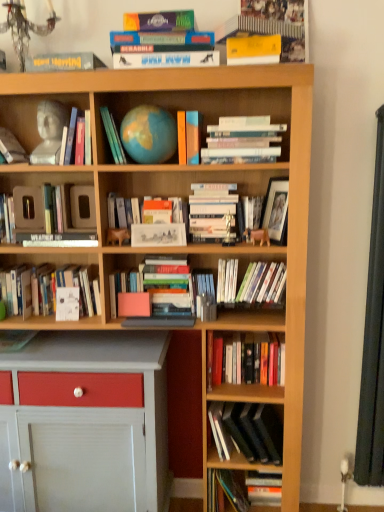
Question: Is hardcover book at center, which is the 10th book from top to bottom, outside of hardcover book at center, which is the 12th book in bottom-to-top order?

Choices:
 (A) yes
 (B) no

Answer: (A)

Question: Is hardcover book at center, which is the 10th book from top to bottom, shorter than hardcover book at center, acting as the 5th book starting from the top?

Choices:
 (A) no
 (B) yes

Answer: (B)

Question: From a real-world perspective, is hardcover book at center, the 7th book in the bottom-to-top sequence, on top of hardcover book at center, acting as the 5th book starting from the top?

Choices:
 (A) yes
 (B) no

Answer: (B)

Question: Could you tell me if hardcover book at center, the 7th book in the bottom-to-top sequence, is facing hardcover book at center, which is the 12th book in bottom-to-top order?

Choices:
 (A) yes
 (B) no

Answer: (B)

Question: Does hardcover book at center, the 7th book in the bottom-to-top sequence, lie in front of hardcover book at center, acting as the 5th book starting from the top?

Choices:
 (A) no
 (B) yes

Answer: (A)

Question: In the image, is hardcover books at center, the second book in the bottom-to-top sequence, positioned in front of or behind white paper at center, the 8th book in the bottom-to-top sequence?

Choices:
 (A) front
 (B) behind

Answer: (B)

Question: Looking at their shapes, would you say hardcover books at center, the 15th book viewed from the top, is wider or thinner than white paper at center, the 8th book in the bottom-to-top sequence?

Choices:
 (A) wide
 (B) thin

Answer: (A)

Question: Considering the positions of hardcover books at center, the second book in the bottom-to-top sequence, and white paper at center, the 9th book viewed from the top, in the image, is hardcover books at center, the second book in the bottom-to-top sequence, bigger or smaller than white paper at center, the 9th book viewed from the top,?

Choices:
 (A) big
 (B) small

Answer: (A)

Question: From a real-world perspective, is hardcover books at center, the second book in the bottom-to-top sequence, above or below white paper at center, the 9th book viewed from the top?

Choices:
 (A) above
 (B) below

Answer: (B)

Question: Is white paperbacks at upper center, acting as the eleventh book starting from the bottom, in front of or behind white paper at center, the 9th book viewed from the top, in the image?

Choices:
 (A) front
 (B) behind

Answer: (A)

Question: Visually, is white paperbacks at upper center, acting as the eleventh book starting from the bottom, positioned to the left or to the right of white paper at center, the 9th book viewed from the top?

Choices:
 (A) left
 (B) right

Answer: (B)

Question: From their relative heights in the image, would you say white paperbacks at upper center, the sixth book viewed from the top, is taller or shorter than white paper at center, the 9th book viewed from the top?

Choices:
 (A) short
 (B) tall

Answer: (A)

Question: Is point (221, 125) positioned closer to the camera than point (182, 224)?

Choices:
 (A) closer
 (B) farther

Answer: (A)

Question: From a real-world perspective, is clear plastic book at center, the thirteenth book from the top, above or below white matte book at center, which is the fifth book from bottom to top?

Choices:
 (A) below
 (B) above

Answer: (A)

Question: Is clear plastic book at center, positioned as the fourth book in bottom-to-top order, taller or shorter than white matte book at center, which is the fifth book from bottom to top?

Choices:
 (A) short
 (B) tall

Answer: (A)